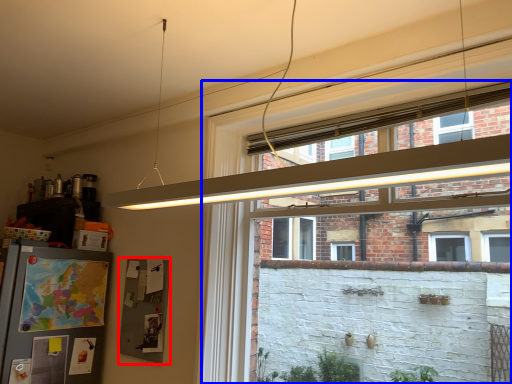
Question: Which object appears farthest to the camera in this image, bulletin board (highlighted by a red box) or window (highlighted by a blue box)?

Choices:
 (A) bulletin board
 (B) window

Answer: (A)